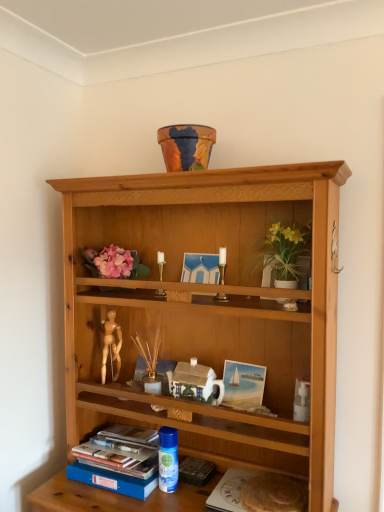
What is the approximate height of gold metallic candle holder at center, positioned as the 1th candle holder in front-to-back order?

It is 16.29 centimeters.

What do you see at coordinates (196, 383) in the screenshot? I see `white ceramic house at center` at bounding box center [196, 383].

You are a GUI agent. You are given a task and a screenshot of the screen. Output one action in this format:
    pyautogui.click(x=<x>, y=<y>)
    Task: Click on the blue hardcover book at lower left
    
    Given the screenshot: What is the action you would take?
    pyautogui.click(x=122, y=450)

The width and height of the screenshot is (384, 512). Describe the element at coordinates (160, 263) in the screenshot. I see `gold metallic candle holder at center, which is counted as the first candle holder, starting from the back` at that location.

What is the approximate height of blue plastic spray can at lower center?

blue plastic spray can at lower center is 7.59 inches tall.

This screenshot has height=512, width=384. What do you see at coordinates (243, 384) in the screenshot?
I see `matte wooden picture frame at center` at bounding box center [243, 384].

You are a GUI agent. You are given a task and a screenshot of the screen. Output one action in this format:
    pyautogui.click(x=<x>, y=<y>)
    Task: Click on the gold metallic candle holder at center, which is the second candle holder in back-to-front order
    
    Given the screenshot: What is the action you would take?
    pyautogui.click(x=222, y=265)

From the picture: From a real-world perspective, which object stands above the other?

In real-world perspective, gold metallic candle holder at center, placed as the second candle holder when sorted from front to back, is above.

Is gold metallic candle holder at center, which is counted as the first candle holder, starting from the back, not near white ceramic house at center?

No, gold metallic candle holder at center, which is counted as the first candle holder, starting from the back, is not far from white ceramic house at center.

Which is more to the left, gold metallic candle holder at center, placed as the second candle holder when sorted from front to back, or white ceramic house at center?

gold metallic candle holder at center, placed as the second candle holder when sorted from front to back, is more to the left.

Is white ceramic house at center completely or partially inside gold metallic candle holder at center, placed as the second candle holder when sorted from front to back?

Actually, white ceramic house at center is outside gold metallic candle holder at center, placed as the second candle holder when sorted from front to back.

Does point (285, 260) lie behind point (216, 295)?

No.

Is white ceramic vase at upper center touching gold metallic candle holder at center, positioned as the 1th candle holder in front-to-back order?

white ceramic vase at upper center and gold metallic candle holder at center, positioned as the 1th candle holder in front-to-back order, are not in contact.

Does white ceramic vase at upper center lie in front of gold metallic candle holder at center, which is the second candle holder in back-to-front order?

Yes, white ceramic vase at upper center is in front of gold metallic candle holder at center, which is the second candle holder in back-to-front order.

Can you confirm if matte wooden picture frame at center is smaller than white ceramic house at center?

Correct, matte wooden picture frame at center occupies less space than white ceramic house at center.

Is matte wooden picture frame at center oriented towards white ceramic house at center?

No, matte wooden picture frame at center is not turned towards white ceramic house at center.

This screenshot has width=384, height=512. Identify the location of stuff in front of the matte wooden picture frame at center. (196, 383).

Does matte wooden picture frame at center have a lesser width compared to white ceramic house at center?

Indeed, matte wooden picture frame at center has a lesser width compared to white ceramic house at center.

Is white ceramic house at center turned away from gold metallic candle holder at center, the 2th candle holder viewed from the left?

No, white ceramic house at center is not facing away from gold metallic candle holder at center, the 2th candle holder viewed from the left.

Is point (206, 380) closer or farther from the camera than point (224, 297)?

Clearly, point (206, 380) is more distant from the camera than point (224, 297).

Find the location of `candle holder that is the 2nd object located above the white ceramic house at center (from the image's perspective)`. candle holder that is the 2nd object located above the white ceramic house at center (from the image's perspective) is located at coordinates (222, 265).

From the picture: Is matte wooden picture frame at center not close to white ceramic vase at upper center?

Actually, matte wooden picture frame at center and white ceramic vase at upper center are a little close together.

From a real-world perspective, is matte wooden picture frame at center above or below white ceramic vase at upper center?

matte wooden picture frame at center is below white ceramic vase at upper center.

Is matte wooden picture frame at center facing away from white ceramic vase at upper center?

That's not correct — matte wooden picture frame at center is not looking away from white ceramic vase at upper center.

Can you confirm if matte wooden picture frame at center is bigger than white ceramic vase at upper center?

Actually, matte wooden picture frame at center might be smaller than white ceramic vase at upper center.

Is the surface of matte wooden picture frame at center in direct contact with gold metallic candle holder at center, which is the second candle holder in back-to-front order?

No.

Can you confirm if matte wooden picture frame at center is shorter than gold metallic candle holder at center, the 2th candle holder viewed from the left?

Yes.

Between matte wooden picture frame at center and gold metallic candle holder at center, which is the second candle holder in back-to-front order, which one appears on the left side from the viewer's perspective?

From the viewer's perspective, gold metallic candle holder at center, which is the second candle holder in back-to-front order, appears more on the left side.

What's the angular difference between matte wooden picture frame at center and gold metallic candle holder at center, which is counted as the 1th candle holder, starting from the right,'s facing directions?

matte wooden picture frame at center and gold metallic candle holder at center, which is counted as the 1th candle holder, starting from the right, are facing 0.335 degrees away from each other.

Is blue hardcover book at lower left not inside matte wooden picture frame at center?

Yes, blue hardcover book at lower left is outside of matte wooden picture frame at center.

Is blue hardcover book at lower left with matte wooden picture frame at center?

No, blue hardcover book at lower left is not with matte wooden picture frame at center.

Considering their positions, is blue hardcover book at lower left located in front of or behind matte wooden picture frame at center?

blue hardcover book at lower left is positioned closer to the viewer than matte wooden picture frame at center.

Considering the sizes of blue hardcover book at lower left and matte wooden picture frame at center in the image, is blue hardcover book at lower left bigger or smaller than matte wooden picture frame at center?

In the image, blue hardcover book at lower left appears to be larger than matte wooden picture frame at center.

Where is `stuff on the right of gold metallic candle holder at center, the first candle holder from the left`? This screenshot has width=384, height=512. stuff on the right of gold metallic candle holder at center, the first candle holder from the left is located at coordinates (196, 383).

From a real-world perspective, starting from the white ceramic vase at upper center, which candle holder is the 1st one below it? Please provide its 2D coordinates.

[(222, 265)]

Based on their spatial positions, is blue hardcover book at lower left or white ceramic vase at upper center further from blue plastic spray can at lower center?

Based on the image, white ceramic vase at upper center appears to be further to blue plastic spray can at lower center.

Considering their positions, is white matte paper at lower center positioned closer to gold metallic candle holder at center, which is the second candle holder in back-to-front order, than white ceramic house at center?

white ceramic house at center is closer to gold metallic candle holder at center, which is the second candle holder in back-to-front order.

Estimate the real-world distances between objects in this image. Which object is closer to gold metallic candle holder at center, which is counted as the first candle holder, starting from the back, blue hardcover book at lower left or white ceramic vase at upper center?

Among the two, white ceramic vase at upper center is located nearer to gold metallic candle holder at center, which is counted as the first candle holder, starting from the back.

Looking at the image, which one is located further to gold metallic candle holder at center, the 2th candle holder viewed from the left, white ceramic vase at upper center or gold metallic candle holder at center, placed as the second candle holder when sorted from front to back?

gold metallic candle holder at center, placed as the second candle holder when sorted from front to back, lies further to gold metallic candle holder at center, the 2th candle holder viewed from the left, than the other object.

Based on their spatial positions, is blue plastic spray can at lower center or gold metallic candle holder at center, the second candle holder viewed from the right, further from white ceramic house at center?

Among the two, gold metallic candle holder at center, the second candle holder viewed from the right, is located further to white ceramic house at center.

Based on their spatial positions, is white ceramic vase at upper center or white matte paper at lower center further from gold metallic candle holder at center, which is the second candle holder in back-to-front order?

Among the two, white matte paper at lower center is located further to gold metallic candle holder at center, which is the second candle holder in back-to-front order.

Which object lies further to the anchor point blue hardcover book at lower left, white matte paper at lower center or gold metallic candle holder at center, the second candle holder viewed from the right?

gold metallic candle holder at center, the second candle holder viewed from the right.

Looking at this image, estimate the real-world distances between objects in this image. Which object is closer to white ceramic house at center, white ceramic vase at upper center or blue plastic spray can at lower center?

blue plastic spray can at lower center lies closer to white ceramic house at center than the other object.

Where is `stuff that lies between white ceramic vase at upper center and blue hardcover book at lower left from top to bottom`? stuff that lies between white ceramic vase at upper center and blue hardcover book at lower left from top to bottom is located at coordinates (196, 383).

The height and width of the screenshot is (512, 384). I want to click on bottle between blue hardcover book at lower left and matte wooden picture frame at center from left to right, so click(168, 459).

Identify the location of bottle between white ceramic house at center and white matte paper at lower center in the up-down direction. (168, 459).

You are a GUI agent. You are given a task and a screenshot of the screen. Output one action in this format:
    pyautogui.click(x=<x>, y=<y>)
    Task: Click on the candle holder between gold metallic candle holder at center, which is the second candle holder in back-to-front order, and blue hardcover book at lower left, in the vertical direction
    
    Given the screenshot: What is the action you would take?
    pyautogui.click(x=160, y=263)